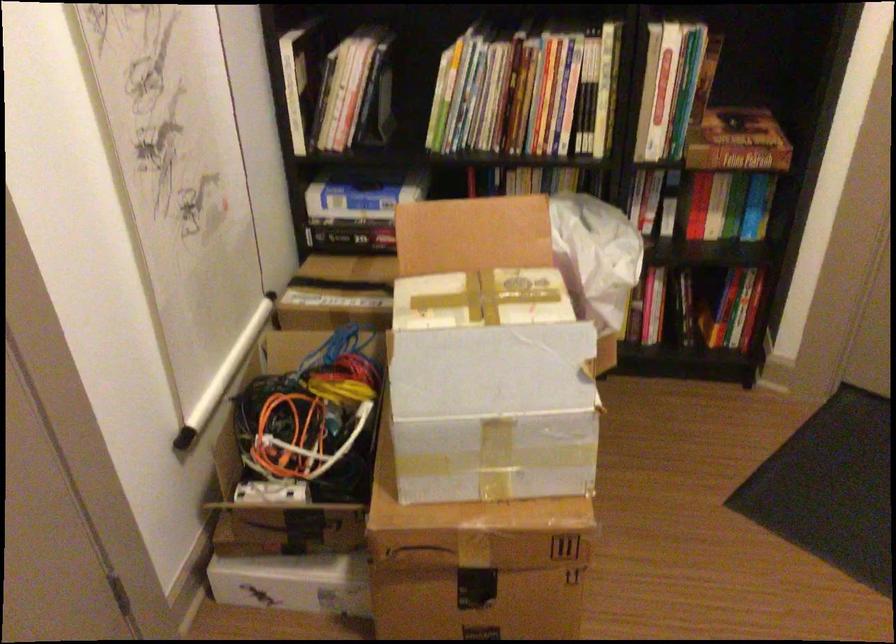
This screenshot has width=896, height=644. Find the location of `white cardboard box`. white cardboard box is located at coordinates (487, 357).